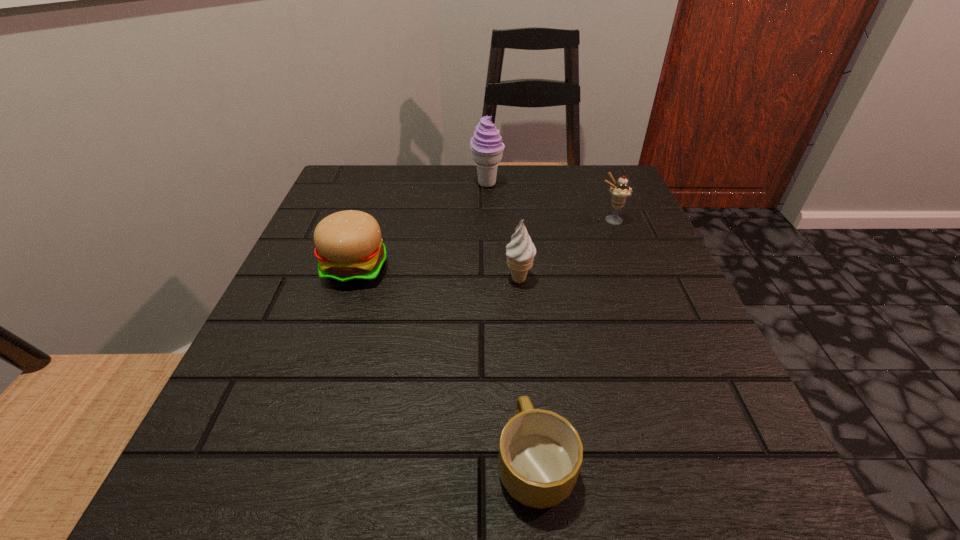
Image resolution: width=960 pixels, height=540 pixels. Identify the location of the farthest icecream. (486, 145).

Locate an element on the screen. The image size is (960, 540). the farthest object is located at coordinates (486, 145).

Where is `the nearest icecream`? the nearest icecream is located at coordinates (520, 252).

The width and height of the screenshot is (960, 540). I want to click on the fourth nearest object, so click(x=620, y=191).

Find the location of a particular element. The image size is (960, 540). the rightmost object is located at coordinates (620, 191).

Find the location of a particular element. The width and height of the screenshot is (960, 540). the leftmost object is located at coordinates (349, 248).

This screenshot has height=540, width=960. What are the coordinates of `mug` in the screenshot? It's located at (540, 454).

In order to click on the nearest object in this screenshot , I will do `click(540, 454)`.

You are a GUI agent. You are given a task and a screenshot of the screen. Output one action in this format:
    pyautogui.click(x=<x>, y=<y>)
    Task: Click on the vacant area located 0.100m on the front of the farthest icecream
    The image size is (960, 540).
    Given the screenshot: What is the action you would take?
    pyautogui.click(x=488, y=216)

Locate an element on the screen. The image size is (960, 540). free space located on the front-facing side of the nearest icecream is located at coordinates (523, 322).